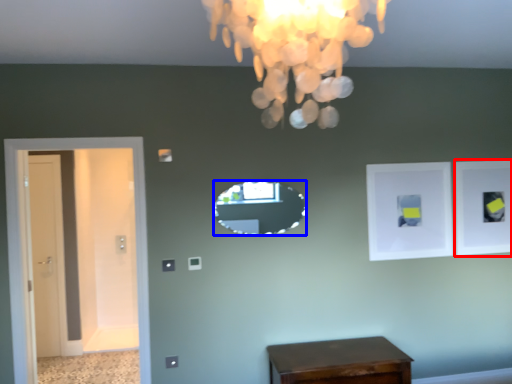
Question: Which of the following is the farthest to the observer, picture frame (highlighted by a red box) or mirror (highlighted by a blue box)?

Choices:
 (A) picture frame
 (B) mirror

Answer: (A)